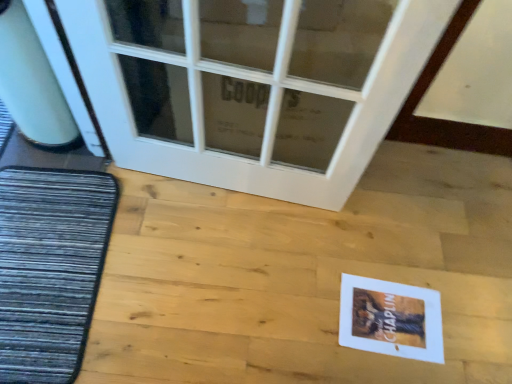
Question: From a real-world perspective, is white glass door at upper center positioned over white paper postcard at lower right based on gravity?

Choices:
 (A) yes
 (B) no

Answer: (A)

Question: Is white glass door at upper center further to camera compared to white paper postcard at lower right?

Choices:
 (A) yes
 (B) no

Answer: (B)

Question: Can you confirm if white glass door at upper center is taller than white paper postcard at lower right?

Choices:
 (A) no
 (B) yes

Answer: (B)

Question: Is the position of white glass door at upper center less distant than that of white paper postcard at lower right?

Choices:
 (A) yes
 (B) no

Answer: (A)

Question: Does white glass door at upper center have a lesser height compared to white paper postcard at lower right?

Choices:
 (A) no
 (B) yes

Answer: (A)

Question: Considering the positions of point (364, 296) and point (68, 218), is point (364, 296) closer or farther from the camera than point (68, 218)?

Choices:
 (A) farther
 (B) closer

Answer: (B)

Question: Relative to dark gray textured mat at left, is white paper postcard at lower right in front or behind?

Choices:
 (A) front
 (B) behind

Answer: (B)

Question: Is white paper postcard at lower right inside or outside of dark gray textured mat at left?

Choices:
 (A) inside
 (B) outside

Answer: (B)

Question: From a real-world perspective, is white paper postcard at lower right above or below dark gray textured mat at left?

Choices:
 (A) below
 (B) above

Answer: (A)

Question: Considering the relative positions of white glass door at upper center and white paper postcard at lower right in the image provided, is white glass door at upper center to the left or to the right of white paper postcard at lower right?

Choices:
 (A) right
 (B) left

Answer: (B)

Question: Looking at the image, does white glass door at upper center seem bigger or smaller compared to white paper postcard at lower right?

Choices:
 (A) small
 (B) big

Answer: (B)

Question: From the image's perspective, is white glass door at upper center located above or below white paper postcard at lower right?

Choices:
 (A) below
 (B) above

Answer: (B)

Question: From a real-world perspective, relative to white paper postcard at lower right, is white glass door at upper center vertically above or below?

Choices:
 (A) below
 (B) above

Answer: (B)

Question: In the image, is dark gray textured mat at left on the left side or the right side of white paper postcard at lower right?

Choices:
 (A) right
 (B) left

Answer: (B)

Question: From a real-world perspective, is dark gray textured mat at left above or below white paper postcard at lower right?

Choices:
 (A) above
 (B) below

Answer: (A)